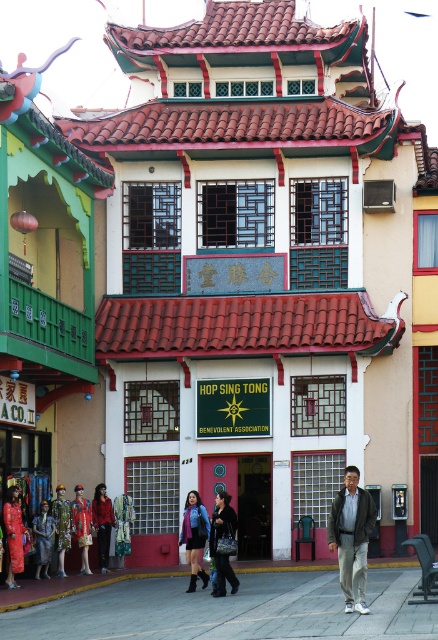
Question: Which of these objects is positioned closest to the matte silver statue at center?

Choices:
 (A) green floral dress at center
 (B) matte green dress at lower left
 (C) matte purple jacket at center
 (D) dark gray jacket at center

Answer: (A)

Question: Can you confirm if matte red dress at lower left is smaller than silk dress at center?

Choices:
 (A) yes
 (B) no

Answer: (B)

Question: Is matte green dress at lower left positioned at the back of matte purple jacket at center?

Choices:
 (A) yes
 (B) no

Answer: (A)

Question: Which object is farther from the camera taking this photo?

Choices:
 (A) green floral dress at center
 (B) dark brown leather jacket at center
 (C) matte red dress at lower left

Answer: (A)

Question: Is matte green dress at lower left wider than dark brown leather jacket at center?

Choices:
 (A) yes
 (B) no

Answer: (A)

Question: Which point appears farthest from the camera in this image?

Choices:
 (A) (67, 545)
 (B) (223, 499)
 (C) (366, 504)

Answer: (A)